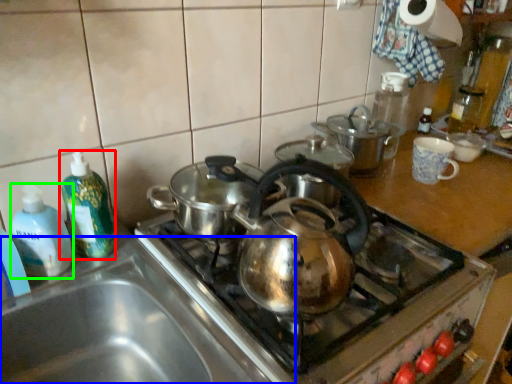
Question: Which is farther away from bottle (highlighted by a red box)? sink (highlighted by a blue box) or bottle (highlighted by a green box)?

Choices:
 (A) sink
 (B) bottle

Answer: (A)